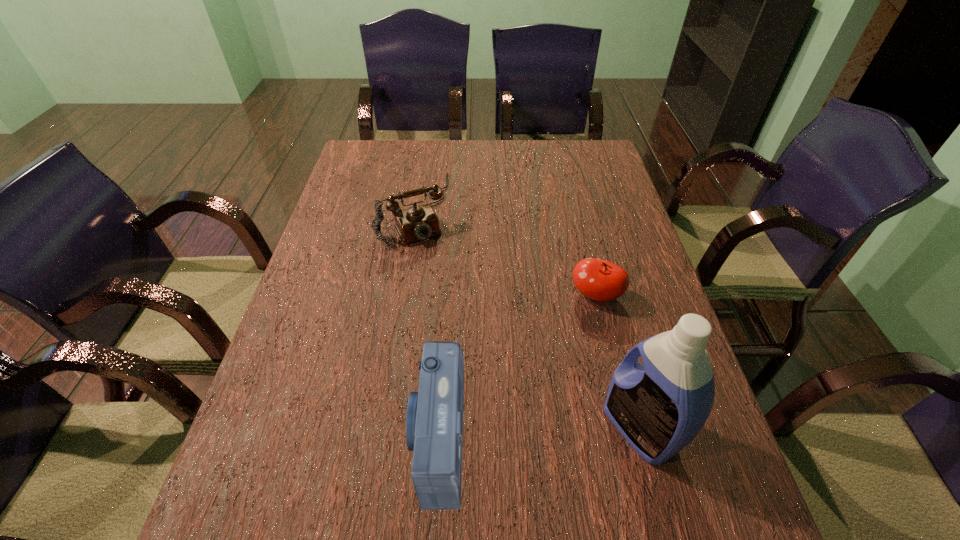
The width and height of the screenshot is (960, 540). What are the coordinates of `free space on the desktop that is between the camera and the detergent and is positioned on the stem of the third nearest object` in the screenshot? It's located at (511, 434).

Where is `vacant space on the desktop that is between the camera and the detergent and is positioned on the dial of the telephone`? The height and width of the screenshot is (540, 960). vacant space on the desktop that is between the camera and the detergent and is positioned on the dial of the telephone is located at coordinates (x=542, y=433).